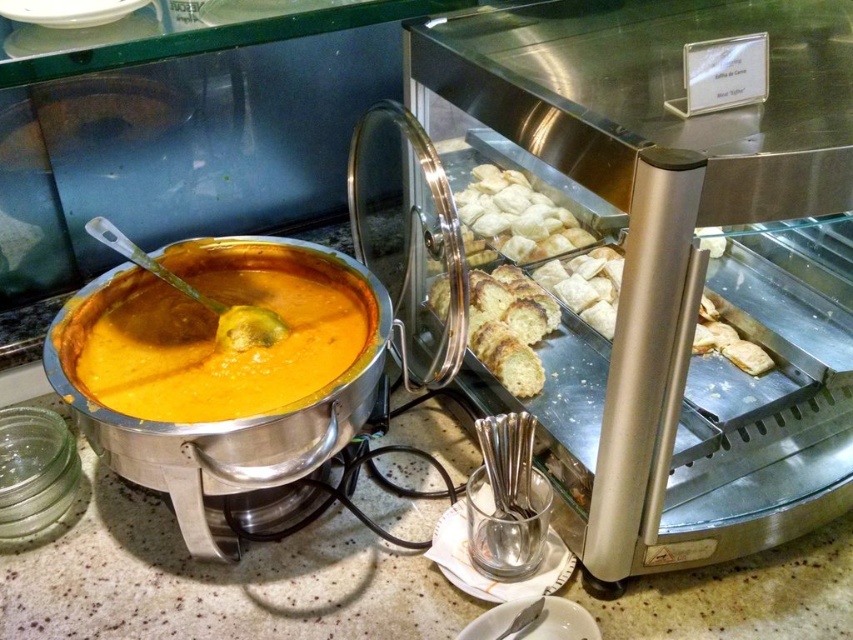
Looking at this image, you are at a buffet and want to choose between the golden brown pastry at center and the golden brown crumbly pastry at center. Which one is bigger?

The golden brown crumbly pastry at center is bigger than the golden brown pastry at center.

You are a guest at a buffet and want to serve yourself soup before the bread. Which item should you approach first, the orange matte soup at center or the golden brown crumbly bread at center?

You should approach the orange matte soup at center first because it is closer to you than the golden brown crumbly bread at center.

You are a guest at a buffet and want to serve yourself soup and pastry. You have a limited reach and can only comfortably reach items closer to you. Which item should you grab first, the orange matte soup at center or the golden brown pastry at center?

The orange matte soup at center is closer to the viewer than the golden brown pastry at center, so you should grab the orange matte soup at center first since it is within your comfortable reach.